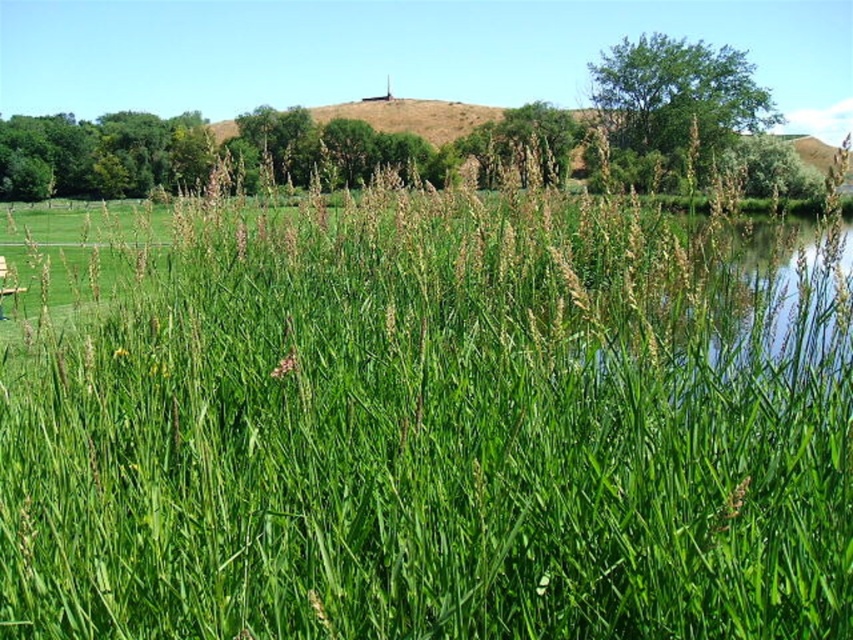
Between green leafy grass at center and wooden park bench at lower left, which one has less height?

With less height is green leafy grass at center.

Does green leafy grass at center have a lesser width compared to wooden park bench at lower left?

Yes.

Between point (344, 580) and point (0, 275), which one is positioned in front?

Point (344, 580) is in front.

This screenshot has width=853, height=640. In order to click on green leafy grass at center in this screenshot , I will do `click(436, 429)`.